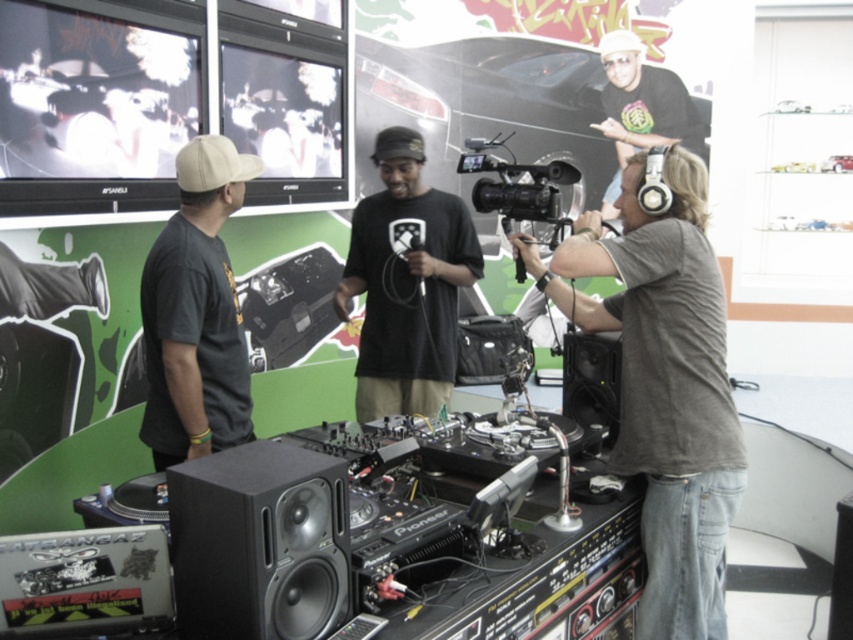
You are standing in front of the DJ booth and want to reach the point closer to you. Which point should you move towards, point (550,221) or point (180,161)?

You should move towards point (180,161) because it is closer to you than point (550,221).

You are a photographer at the event and need to capture a closeup shot of the white matte baseball cap at upper left. You have a black plastic video camera at center. Can you use this camera to zoom in enough for the closeup?

The black plastic video camera at center has a larger size compared to white matte baseball cap at upper left, but the size difference does not indicate zoom capability. You need to check if the camera has a zoom lens or optical zoom feature to determine if it can capture a closeup.

You are a photographer trying to capture a candid shot of the black matte shirt at center and the white matte baseball hat at upper center. Since you want to ensure both subjects are in focus, you need to know which one is wider. Which object has a greater width?

The black matte shirt at center has a greater width than the white matte baseball hat at upper center.